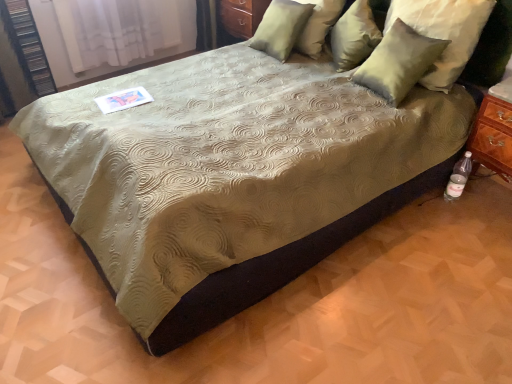
Question: Considering the relative sizes of satin green pillow at upper right, the fourth pillow from the left, and satin green pillow at upper right, acting as the first pillow starting from the left, in the image provided, is satin green pillow at upper right, the fourth pillow from the left, taller than satin green pillow at upper right, acting as the first pillow starting from the left,?

Choices:
 (A) yes
 (B) no

Answer: (A)

Question: From a real-world perspective, is satin green pillow at upper right, the fourth pillow from the left, located beneath satin green pillow at upper right, acting as the first pillow starting from the left?

Choices:
 (A) no
 (B) yes

Answer: (A)

Question: Could satin green pillow at upper right, acting as the first pillow starting from the left, be considered to be inside satin green pillow at upper right, which is the first pillow in right-to-left order?

Choices:
 (A) no
 (B) yes

Answer: (A)

Question: Does satin green pillow at upper right, which is the first pillow in right-to-left order, have a lesser width compared to satin green pillow at upper right, acting as the 4th pillow starting from the right?

Choices:
 (A) yes
 (B) no

Answer: (B)

Question: Is satin green pillow at upper right, which is the first pillow in right-to-left order, completely or partially outside of satin green pillow at upper right, acting as the 4th pillow starting from the right?

Choices:
 (A) yes
 (B) no

Answer: (A)

Question: From the image's perspective, is satin green pillow at upper right, acting as the 4th pillow starting from the right, located above or below satin green pillow at upper right, the third pillow viewed from the left?

Choices:
 (A) above
 (B) below

Answer: (A)

Question: Considering the positions of satin green pillow at upper right, acting as the 4th pillow starting from the right, and satin green pillow at upper right, the third pillow viewed from the left, in the image, is satin green pillow at upper right, acting as the 4th pillow starting from the right, taller or shorter than satin green pillow at upper right, the third pillow viewed from the left,?

Choices:
 (A) short
 (B) tall

Answer: (B)

Question: In terms of width, does satin green pillow at upper right, acting as the 4th pillow starting from the right, look wider or thinner when compared to satin green pillow at upper right, marked as the second pillow in a right-to-left arrangement?

Choices:
 (A) wide
 (B) thin

Answer: (B)

Question: Relative to satin green pillow at upper right, the third pillow viewed from the left, is satin green pillow at upper right, acting as the 4th pillow starting from the right, in front or behind?

Choices:
 (A) behind
 (B) front

Answer: (A)

Question: Is point (377, 61) closer or farther from the camera than point (464, 165)?

Choices:
 (A) farther
 (B) closer

Answer: (B)

Question: In the image, is satin green pillow at upper right, marked as the second pillow in a right-to-left arrangement, on the left side or the right side of clear plastic bottle at lower right?

Choices:
 (A) right
 (B) left

Answer: (B)

Question: From the image's perspective, is satin green pillow at upper right, the third pillow viewed from the left, located above or below clear plastic bottle at lower right?

Choices:
 (A) above
 (B) below

Answer: (A)

Question: From a real-world perspective, is satin green pillow at upper right, marked as the second pillow in a right-to-left arrangement, above or below clear plastic bottle at lower right?

Choices:
 (A) below
 (B) above

Answer: (B)

Question: In the image, is matte wood dresser at upper center on the left side or the right side of satin green pillow at upper right, the fourth pillow from the left?

Choices:
 (A) right
 (B) left

Answer: (B)

Question: From a real-world perspective, is matte wood dresser at upper center physically located above or below satin green pillow at upper right, which is the first pillow in right-to-left order?

Choices:
 (A) above
 (B) below

Answer: (B)